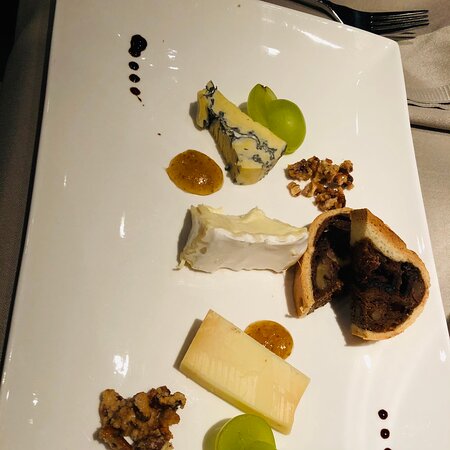
Locate an element on the screen. The width and height of the screenshot is (450, 450). plate is located at coordinates (130, 317).